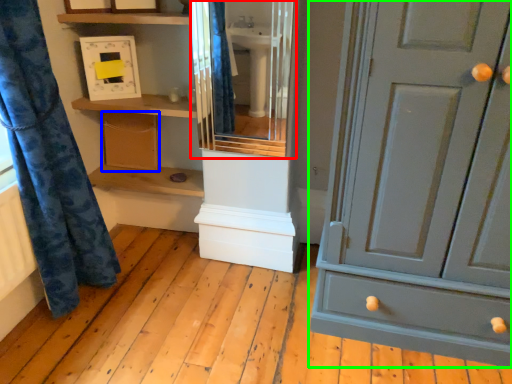
Question: Which is nearer to the cabinet (highlighted by a red box)? cabinetry (highlighted by a blue box) or chest of drawers (highlighted by a green box).

Choices:
 (A) cabinetry
 (B) chest of drawers

Answer: (A)